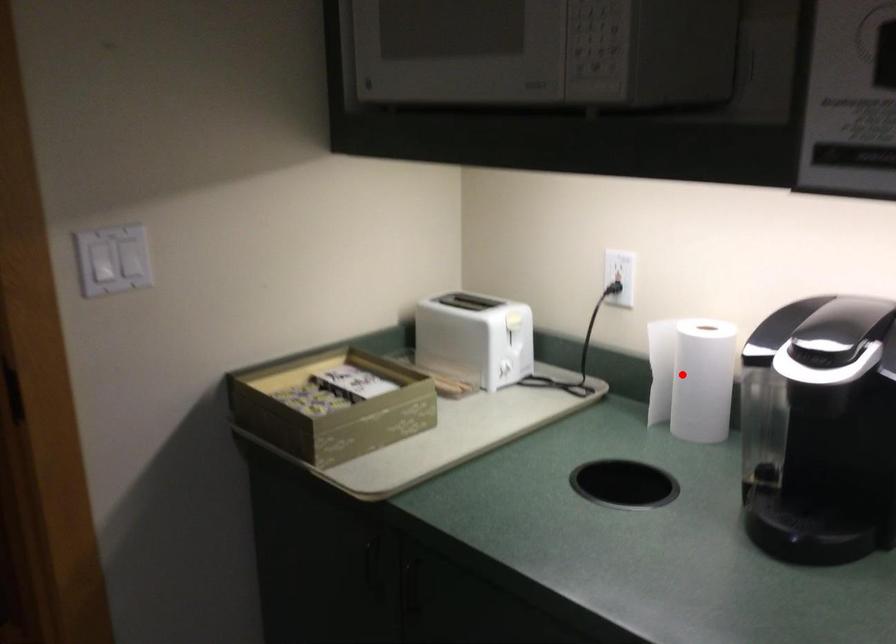
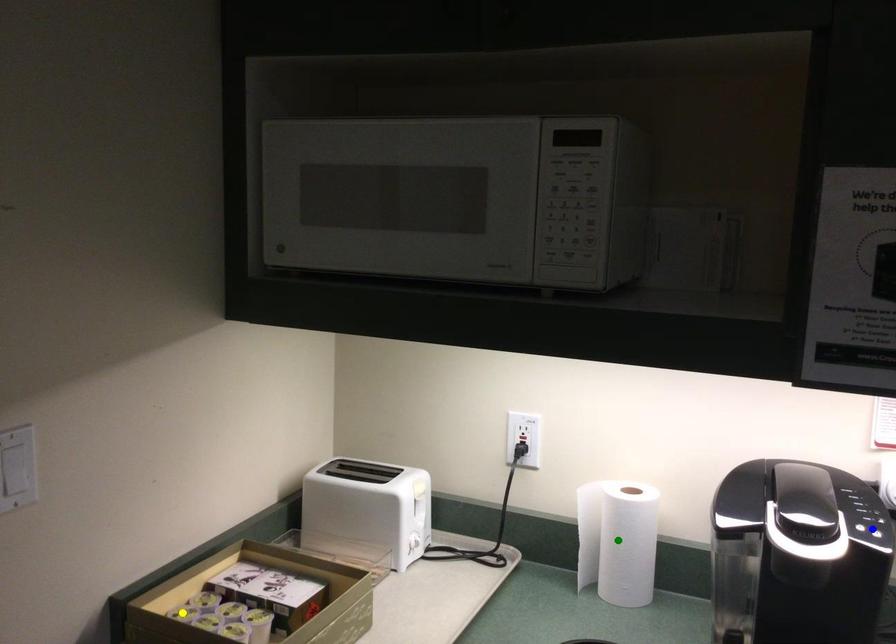
Question: I am providing you with two images of the same scene from different viewpoints. A red point is marked on the first image. You are given multiple points on the second image. Which spot in image 2 lines up with the point in image 1?

Choices:
 (A) green point
 (B) yellow point
 (C) blue point

Answer: (A)